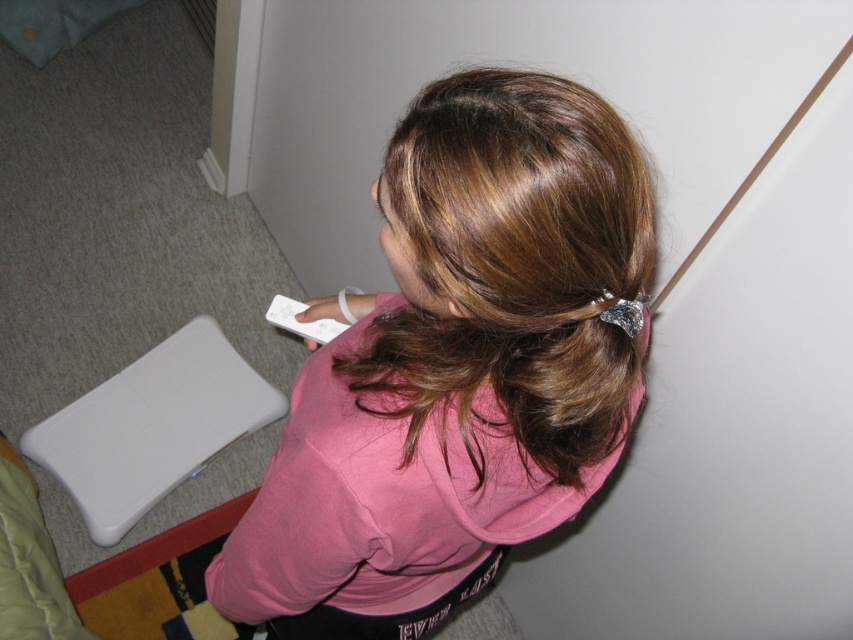
You are a game developer designing a new motion control game. You need to ensure that the remote is visible above the shirt to avoid blocking the sensor. Based on the image, is the white plastic remote at center positioned above the pink fabric shirt at center?

Yes, the white plastic remote at center is positioned above the pink fabric shirt at center, so the sensor should be visible and functional.